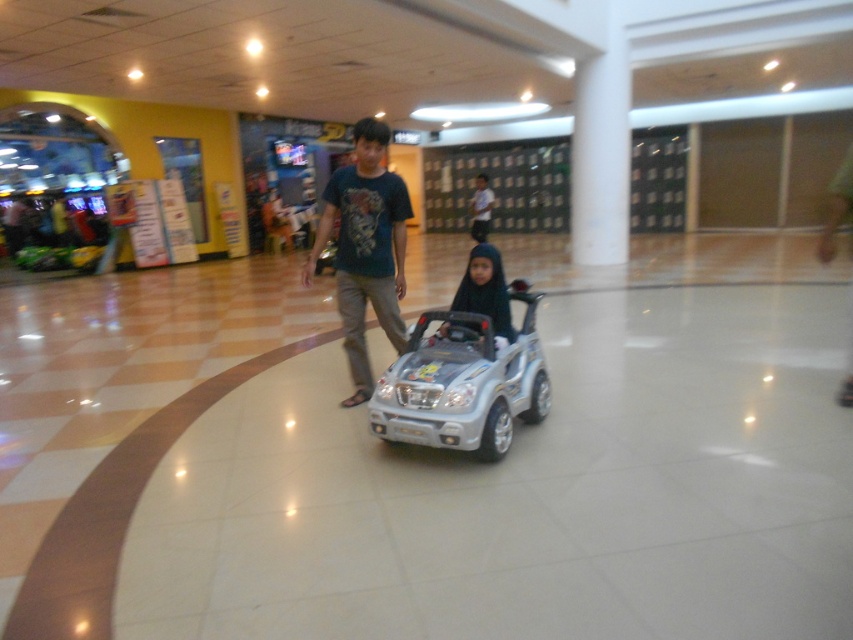
Question: Does silver metallic toy car at center appear on the right side of dark blue t-shirt at center?

Choices:
 (A) yes
 (B) no

Answer: (A)

Question: Among these objects, which one is nearest to the camera?

Choices:
 (A) dark blue t-shirt at center
 (B) silver metallic toy car at center
 (C) matte blue shirt at center
 (D) dark blue fabric hijab at center

Answer: (B)

Question: Which point is farther to the camera?

Choices:
 (A) (366, 387)
 (B) (473, 276)
 (C) (376, 388)
 (D) (480, 196)

Answer: (D)

Question: Which point is farther to the camera?

Choices:
 (A) (476, 275)
 (B) (474, 208)
 (C) (387, 438)
 (D) (343, 184)

Answer: (B)

Question: Is silver metallic toy car at center above dark blue fabric hijab at center?

Choices:
 (A) no
 (B) yes

Answer: (A)

Question: Can you confirm if silver metallic toy car at center is positioned below dark blue fabric hijab at center?

Choices:
 (A) no
 (B) yes

Answer: (B)